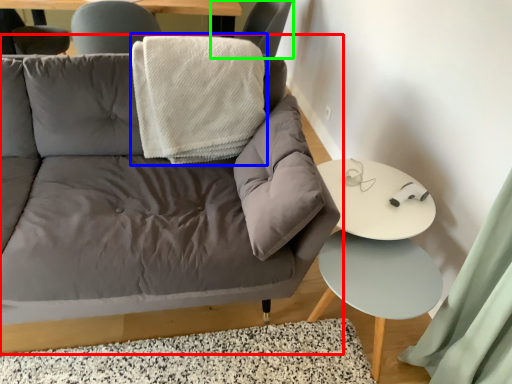
Question: Estimate the real-world distances between objects in this image. Which object is farther from studio couch (highlighted by a red box), blanket (highlighted by a blue box) or chair (highlighted by a green box)?

Choices:
 (A) blanket
 (B) chair

Answer: (B)